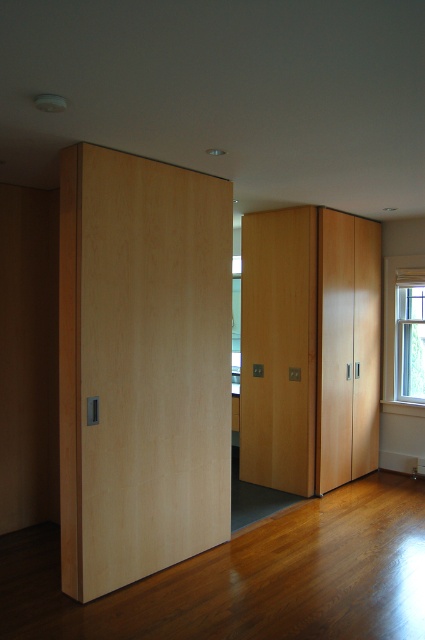
Question: Among these objects, which one is farthest from the camera?

Choices:
 (A) light wood door at center
 (B) light wood/veneer door at left
 (C) matte wood cabinet at center
 (D) clear glass window at right

Answer: (D)

Question: Which point is closer to the camera?

Choices:
 (A) light wood door at center
 (B) matte wood cabinet at center

Answer: (A)

Question: Does light wood door at center have a lesser width compared to matte wood cabinet at center?

Choices:
 (A) yes
 (B) no

Answer: (A)

Question: From the image, what is the correct spatial relationship of light wood door at center in relation to clear glass window at right?

Choices:
 (A) above
 (B) below

Answer: (B)

Question: Where is light wood/veneer door at left located in relation to clear glass window at right in the image?

Choices:
 (A) right
 (B) left

Answer: (B)

Question: Based on their relative distances, which object is nearer to the matte wood cabinet at center?

Choices:
 (A) clear glass window at right
 (B) light wood door at center
 (C) light wood/veneer door at left

Answer: (B)